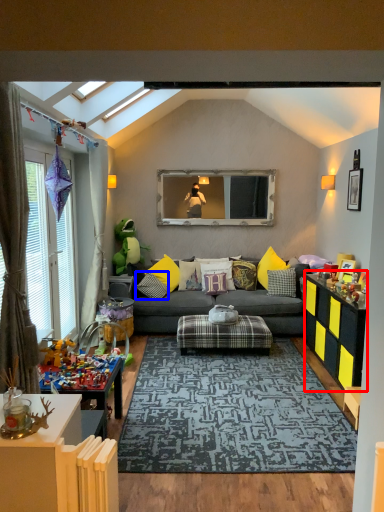
Question: Which object is closer to the camera taking this photo, dresser (highlighted by a red box) or pillow (highlighted by a blue box)?

Choices:
 (A) dresser
 (B) pillow

Answer: (A)